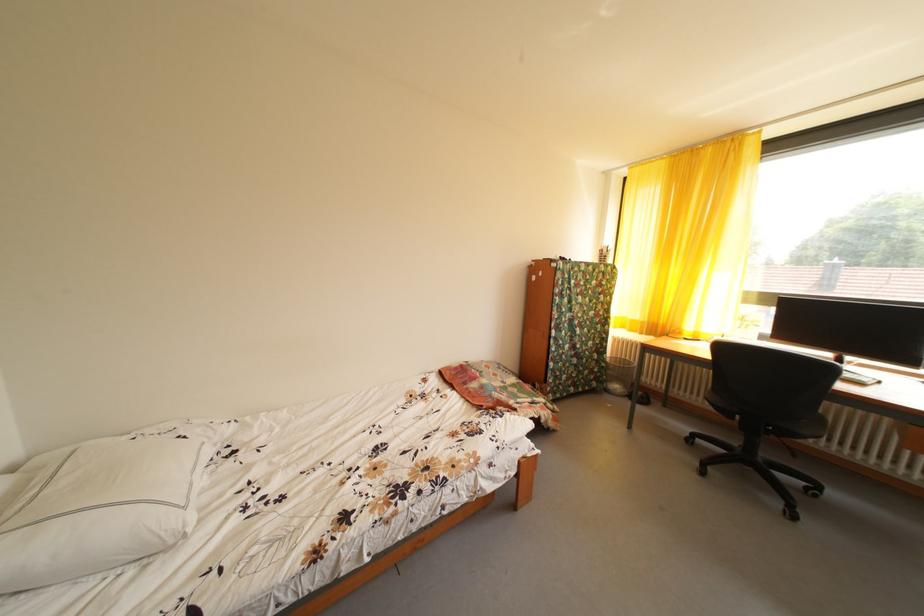
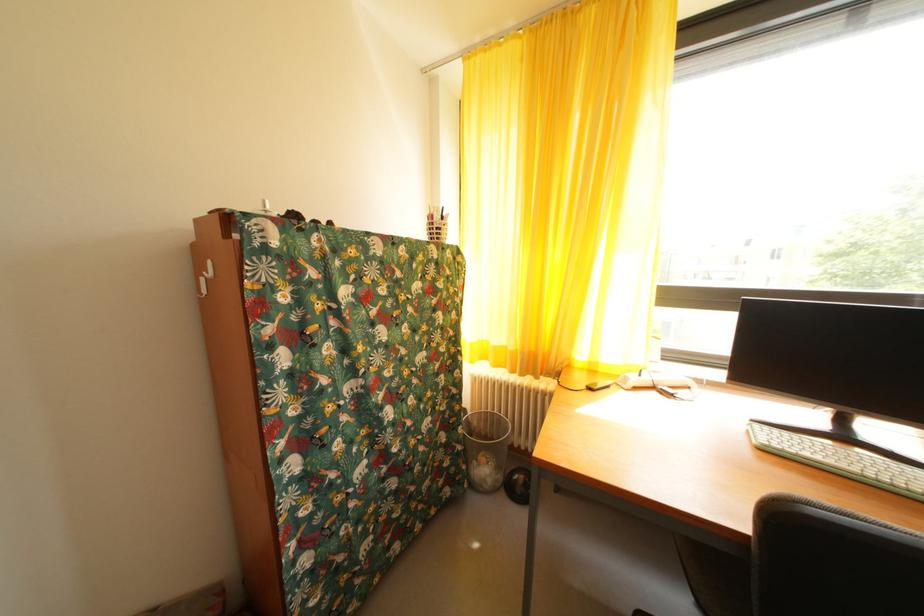
The point at (613, 371) is marked in the first image. Where is the corresponding point in the second image?

(468, 454)